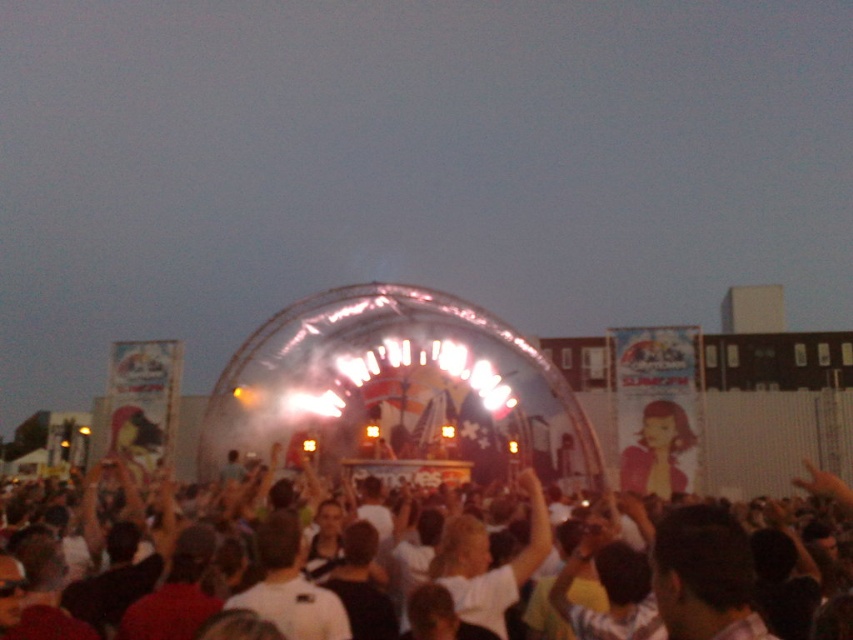
Question: Which of the following is the farthest from the observer?

Choices:
 (A) white cotton crowd at center
 (B) matte pink shirt at center

Answer: (B)

Question: Is white cotton crowd at center smaller than matte pink shirt at center?

Choices:
 (A) yes
 (B) no

Answer: (B)

Question: Which of the following is the closest to the observer?

Choices:
 (A) (668, 403)
 (B) (263, 563)

Answer: (B)

Question: Does white cotton crowd at center appear under matte pink shirt at center?

Choices:
 (A) no
 (B) yes

Answer: (B)

Question: Is white cotton crowd at center bigger than matte pink shirt at center?

Choices:
 (A) yes
 (B) no

Answer: (A)

Question: Which object is farther from the camera taking this photo?

Choices:
 (A) white cotton crowd at center
 (B) matte pink shirt at center

Answer: (B)